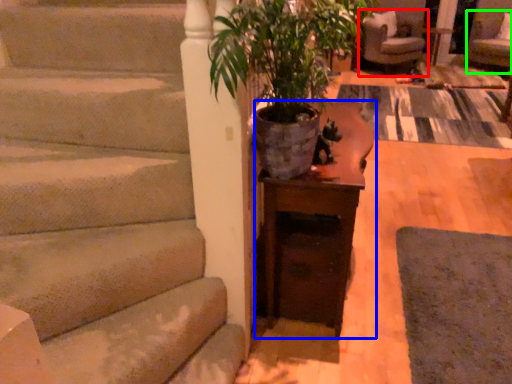
Question: Which object is positioned farthest from chair (highlighted by a red box)? Select from table (highlighted by a blue box) and armchair (highlighted by a green box).

Choices:
 (A) table
 (B) armchair

Answer: (A)